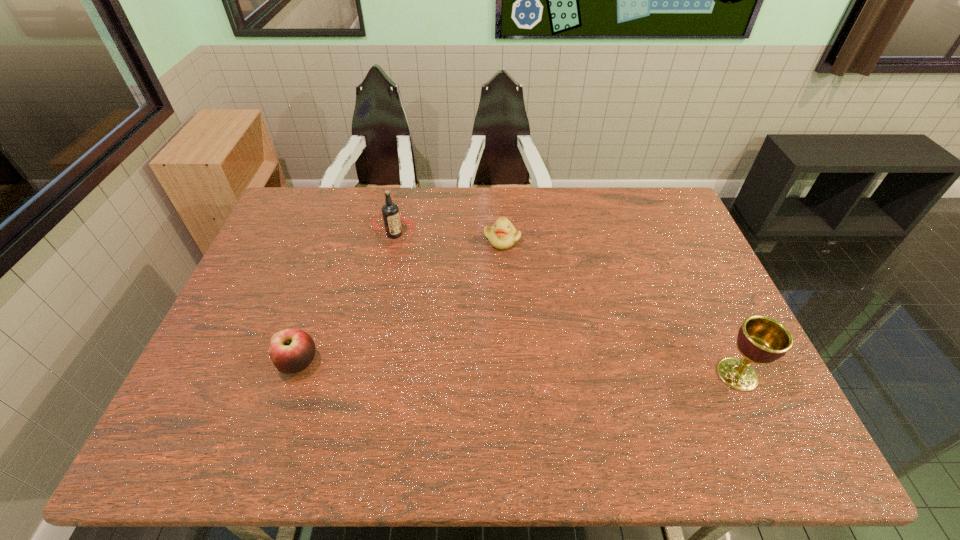
Locate an element on the screen. The width and height of the screenshot is (960, 540). vacant area between the second object from left to right and the chalice is located at coordinates (565, 305).

This screenshot has height=540, width=960. In order to click on vacant area that lies between the rightmost object and the second object from left to right in this screenshot , I will do `click(565, 305)`.

You are a GUI agent. You are given a task and a screenshot of the screen. Output one action in this format:
    pyautogui.click(x=<x>, y=<y>)
    Task: Click on the vacant area that lies between the second object from left to right and the duckling
    This screenshot has height=540, width=960.
    Given the screenshot: What is the action you would take?
    pyautogui.click(x=448, y=237)

Identify the location of vacant area that lies between the root beer and the chalice. The image size is (960, 540). (565, 305).

Where is `empty location between the apple and the root beer`? This screenshot has width=960, height=540. empty location between the apple and the root beer is located at coordinates (347, 299).

The height and width of the screenshot is (540, 960). Find the location of `vacant area between the third object from right to left and the third tallest object`. vacant area between the third object from right to left and the third tallest object is located at coordinates (347, 299).

This screenshot has width=960, height=540. I want to click on empty space between the rightmost object and the leftmost object, so click(518, 369).

Where is `free spot between the chalice and the apple`? The height and width of the screenshot is (540, 960). free spot between the chalice and the apple is located at coordinates (518, 369).

Point out which object is positioned as the third nearest to the root beer. Please provide its 2D coordinates. Your answer should be formatted as a tuple, i.e. [(x, y)], where the tuple contains the x and y coordinates of a point satisfying the conditions above.

[(761, 339)]

Where is `object that is the nearest to the duckling`? This screenshot has width=960, height=540. object that is the nearest to the duckling is located at coordinates (392, 219).